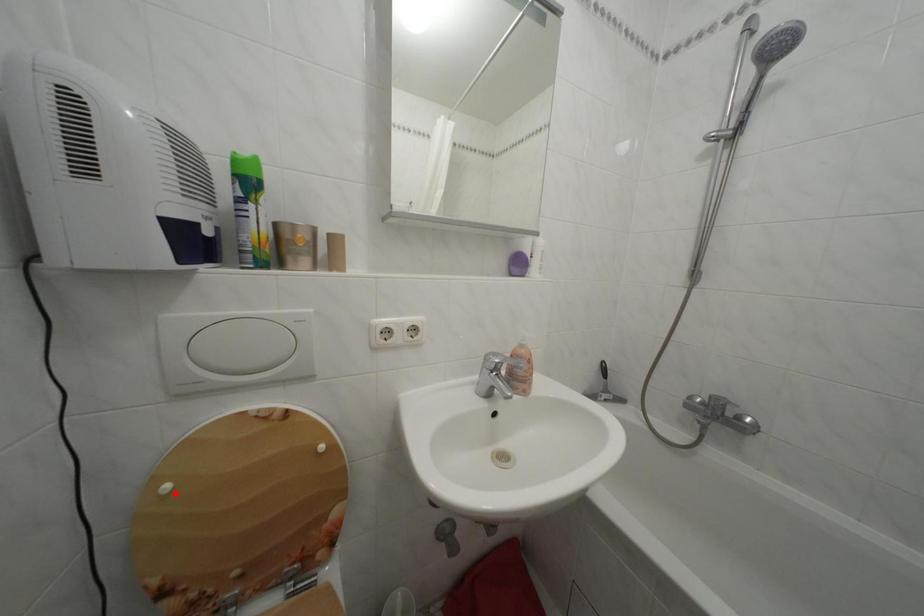
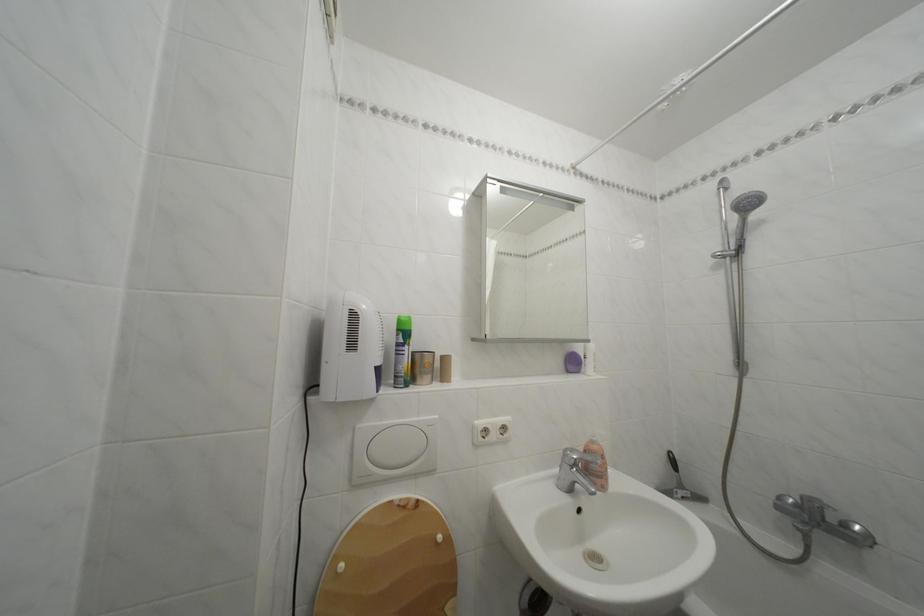
Where in the second image is the point corresponding to the highlighted location from the first image?

(350, 573)